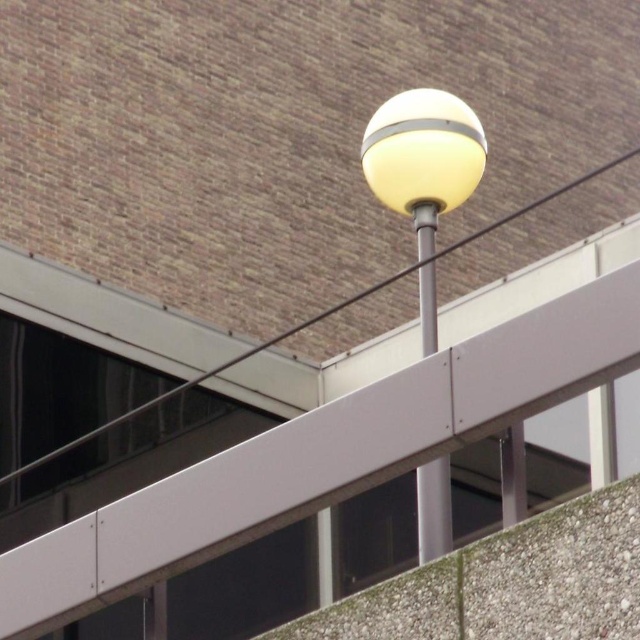
You are a city planner assessing the streetlamp design. The matte white globe at center and the metallic pole at center must both be visible in the design. Given their sizes, which object would likely cast a wider shadow on the ground?

The matte white globe at center is larger in size than the metallic pole at center, so it would cast a wider shadow on the ground.

Consider the image. You are a city planner assessing the streetlamp design. You need to determine if the matte white globe at center will block the view of the metallic pole at center from the sidewalk. Based on their widths, can you conclude this?

The matte white globe at center is wider than the metallic pole at center, so it could potentially block the view of the metallic pole at center depending on their positioning.